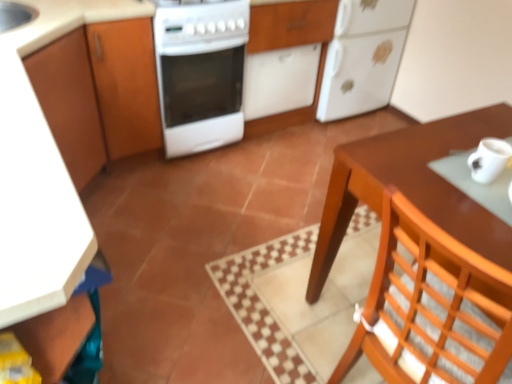
The width and height of the screenshot is (512, 384). Identify the location of free location in front of white matte mug at right. (474, 205).